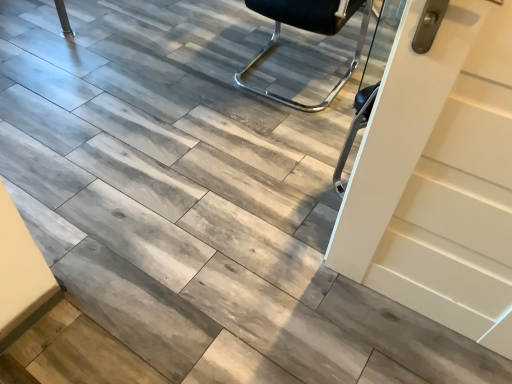
Question: From their relative heights in the image, would you say black leather chair at center is taller or shorter than white glossy door at right?

Choices:
 (A) short
 (B) tall

Answer: (A)

Question: Considering the positions of black leather chair at center and white glossy door at right in the image, is black leather chair at center wider or thinner than white glossy door at right?

Choices:
 (A) thin
 (B) wide

Answer: (B)

Question: Is black leather chair at center inside the boundaries of white glossy door at right, or outside?

Choices:
 (A) inside
 (B) outside

Answer: (B)

Question: In terms of height, does white glossy door at right look taller or shorter compared to black leather chair at center?

Choices:
 (A) tall
 (B) short

Answer: (A)

Question: From a real-world perspective, is white glossy door at right physically located above or below black leather chair at center?

Choices:
 (A) above
 (B) below

Answer: (A)

Question: In terms of width, does white glossy door at right look wider or thinner when compared to black leather chair at center?

Choices:
 (A) wide
 (B) thin

Answer: (B)

Question: From the image's perspective, is white glossy door at right above or below black leather chair at center?

Choices:
 (A) below
 (B) above

Answer: (A)